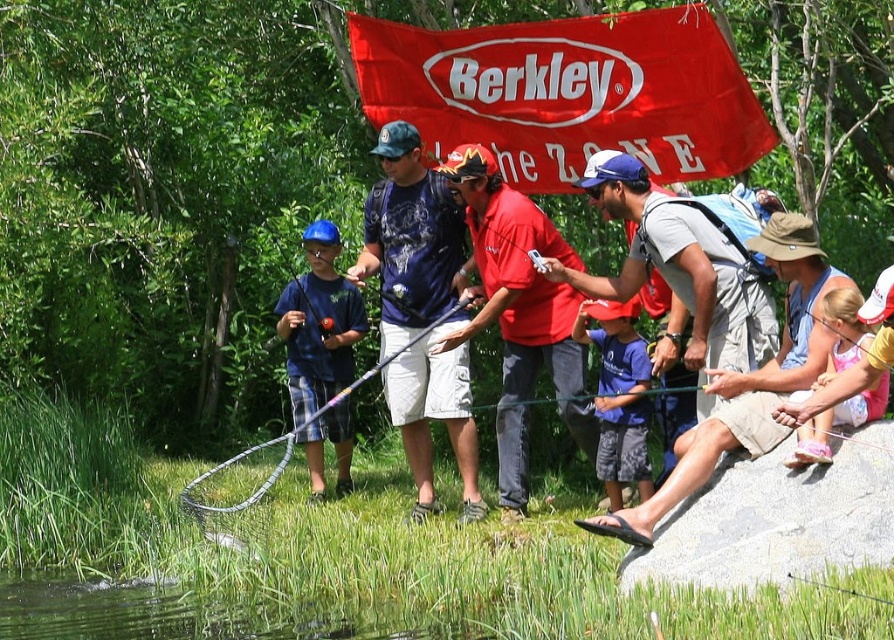
Question: Estimate the real-world distances between objects in this image. Which object is closer to the blue fabric shirt at center?

Choices:
 (A) silver metallic fishing pole at center
 (B) dark blue t-shirt at center

Answer: (A)

Question: Among these objects, which one is nearest to the camera?

Choices:
 (A) silver metallic fishing pole at center
 (B) red cotton shirt at center
 (C) light gray cotton shirt at center

Answer: (C)

Question: Considering the real-world distances, which object is farthest from the dark blue t-shirt at center?

Choices:
 (A) blue fabric shirt at center
 (B) silver metallic fishing pole at center
 (C) gray smooth rock at lower right

Answer: (C)

Question: Does gray smooth rock at lower right appear on the left side of green grass at lower center?

Choices:
 (A) yes
 (B) no

Answer: (B)

Question: Is light gray cotton shirt at center positioned at the back of green grass at lower center?

Choices:
 (A) no
 (B) yes

Answer: (B)

Question: Where is gray smooth rock at lower right located in relation to blue cotton shirt at center in the image?

Choices:
 (A) below
 (B) above

Answer: (A)